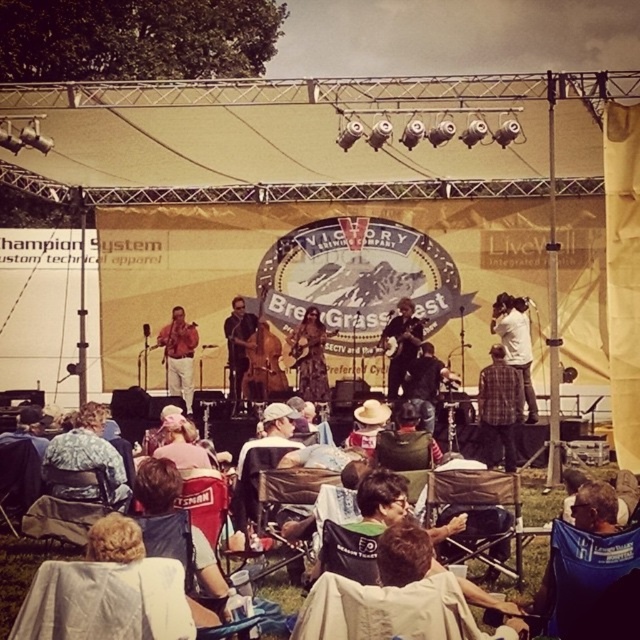
You are a photographer at the BrewGrass Fest event. You need to capture a photo of both the matte brown shirt at center and the dark brown leather jacket at center. According to the scene description, which one is positioned higher in the frame?

The matte brown shirt at center is above dark brown leather jacket at center, so the matte brown shirt at center is positioned higher in the frame.

You are a photographer at the BrewGrass Fest. You need to capture a photo that includes both the white shirt at upper center and the dark brown leather jacket at center. Which object should you focus on first to ensure both are in frame?

The white shirt at upper center is positioned over the dark brown leather jacket at center. To include both in the frame, focus on the dark brown leather jacket at center first as it is lower and the white shirt is above it.